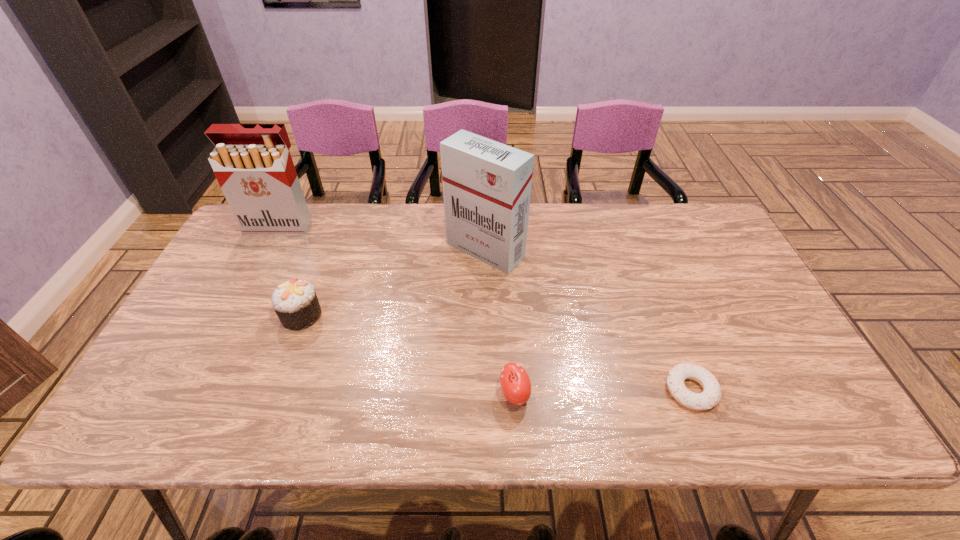
The image size is (960, 540). What are the coordinates of `blank space at the far right corner of the desktop` in the screenshot? It's located at (668, 206).

Identify the location of vacant space in between the second shortest object and the leftmost object. (396, 310).

Identify the location of unoccupied position between the right cigarette case and the cupcake. (394, 283).

Locate an element on the screen. This screenshot has height=540, width=960. empty location between the doughnut and the right cigarette case is located at coordinates (588, 320).

Where is `vacant area that lies between the second shortest object and the right cigarette case`? The image size is (960, 540). vacant area that lies between the second shortest object and the right cigarette case is located at coordinates (500, 322).

Locate an element on the screen. vacant region between the leftmost object and the second object from left to right is located at coordinates (290, 271).

You are a GUI agent. You are given a task and a screenshot of the screen. Output one action in this format:
    pyautogui.click(x=<x>, y=<y>)
    Task: Click on the free space between the right cigarette case and the shortest object
    
    Given the screenshot: What is the action you would take?
    pyautogui.click(x=588, y=320)

You are a GUI agent. You are given a task and a screenshot of the screen. Output one action in this format:
    pyautogui.click(x=<x>, y=<y>)
    Task: Click on the vacant point located between the left cigarette case and the second shortest object
    
    Given the screenshot: What is the action you would take?
    pyautogui.click(x=396, y=310)

At what (x,y) coordinates should I click in order to perform the action: click on unoccupied area between the third nearest object and the shortest object. Please return your answer as a coordinate pair (x, y). The height and width of the screenshot is (540, 960). Looking at the image, I should click on (496, 353).

You are a GUI agent. You are given a task and a screenshot of the screen. Output one action in this format:
    pyautogui.click(x=<x>, y=<y>)
    Task: Click on the vacant space that is in between the rightmost object and the apple
    Image resolution: width=960 pixels, height=540 pixels.
    Given the screenshot: What is the action you would take?
    tap(603, 393)